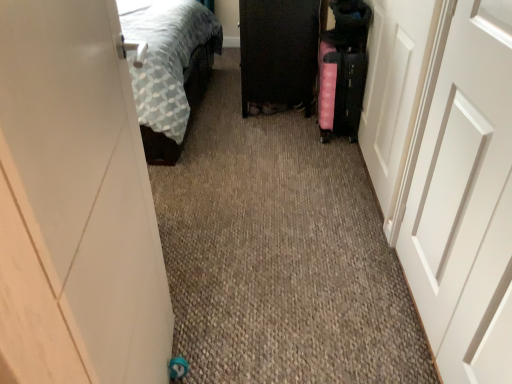
Identify the location of free space in front of black glossy cabinet at center. This screenshot has height=384, width=512. (267, 153).